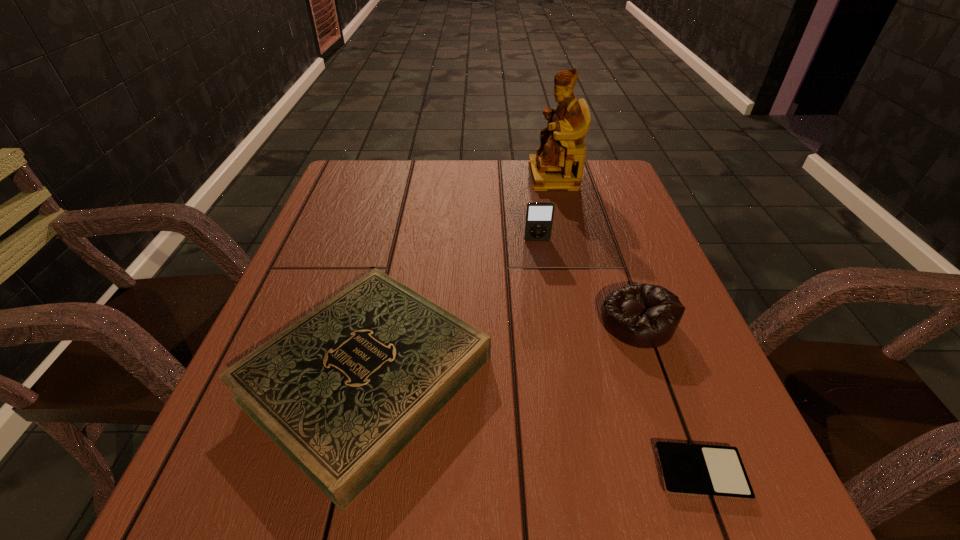
Identify the location of figurine. The width and height of the screenshot is (960, 540). (558, 164).

The width and height of the screenshot is (960, 540). I want to click on the farthest object, so click(x=558, y=164).

Where is `the second farthest object`? The image size is (960, 540). the second farthest object is located at coordinates (539, 216).

In order to click on the fourth shortest object in this screenshot , I will do `click(539, 216)`.

Find the location of `beanbag`. beanbag is located at coordinates (642, 315).

This screenshot has width=960, height=540. In order to click on the fourth tallest object in this screenshot , I will do `click(343, 390)`.

Identify the location of hardback book. The image size is (960, 540). (343, 390).

Locate an element on the screen. The height and width of the screenshot is (540, 960). the shorter iPod is located at coordinates (712, 471).

Find the location of `the right iPod`. the right iPod is located at coordinates (712, 471).

Find the location of `free space located 0.400m on the front-facing side of the farthest object`. free space located 0.400m on the front-facing side of the farthest object is located at coordinates (391, 177).